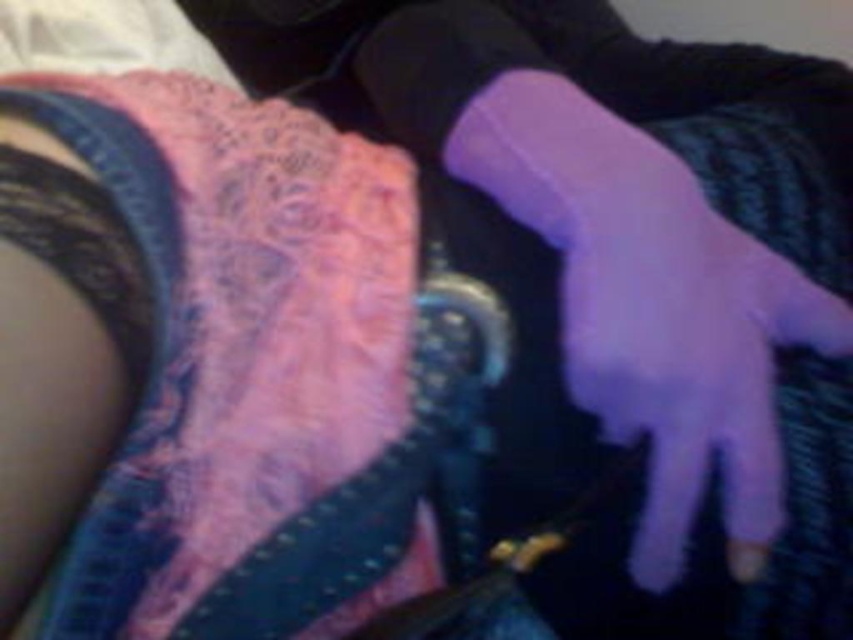
You are trying to place a new decorative item on the surface shown in the image. The coordinates of the purple matte glove at center are given as point (683, 353). If you want to place the item exactly where the glove is currently positioned, what should you do first?

You should first remove the purple matte glove at center from its current position at point (683, 353) to place the new decorative item there.

You are taking a photo of the scene and want to focus on the closest point between point (x=618, y=291) and point (x=503, y=132). Which point should you focus on?

Point (x=618, y=291) is closer to the camera than point (x=503, y=132), so you should focus on point (x=618, y=291).

Based on the photo, you are a fashion designer examining a model wearing both a purple matte glove at center and a purple matte sock at center. From the observer perspective, which item is closer to you?

The purple matte glove at center is in front of the purple matte sock at center, so it is closer to the observer.